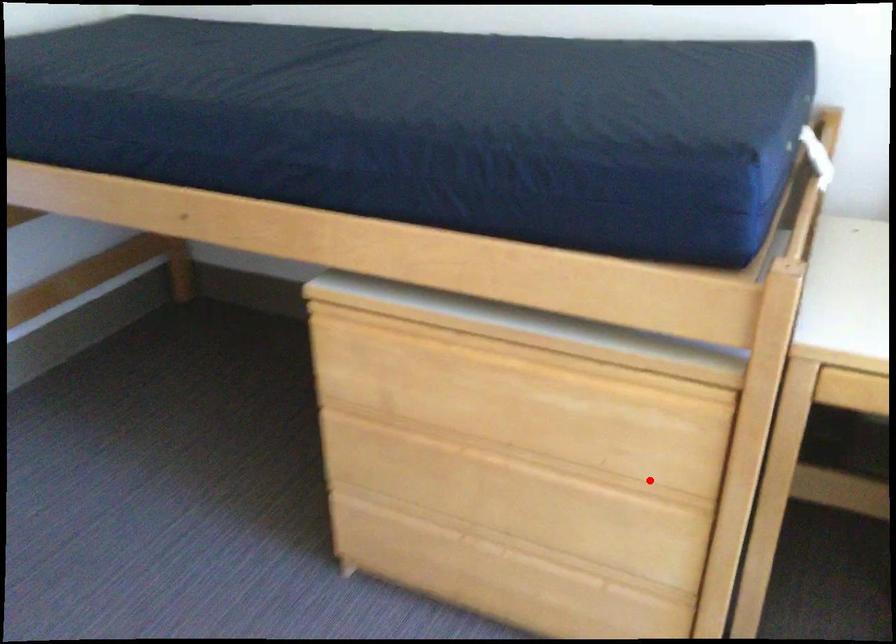
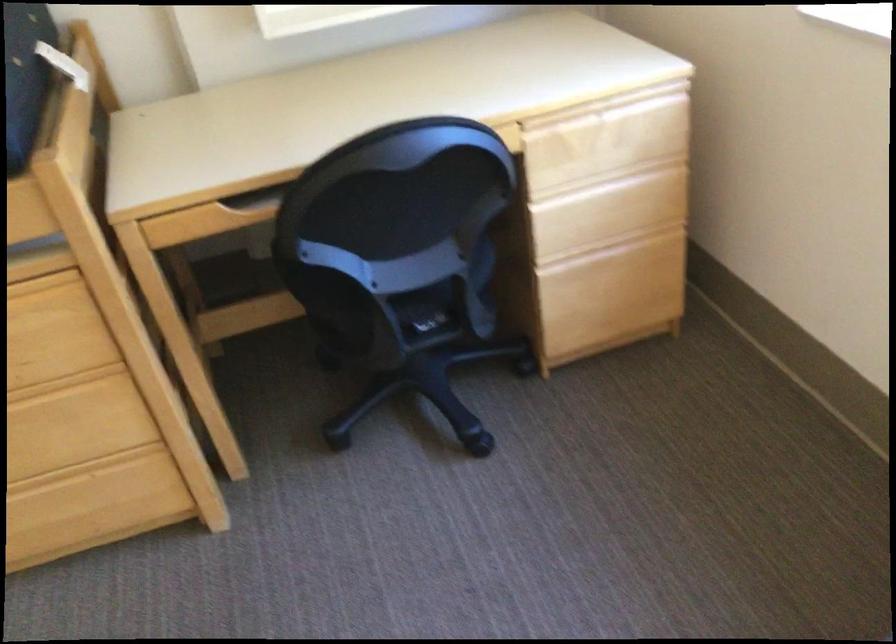
Question: I am providing you with two images of the same scene from different viewpoints. In image1, a red point is highlighted. Considering the same 3D point in image2, which of the following is correct?

Choices:
 (A) It is closer
 (B) It is farther

Answer: (B)